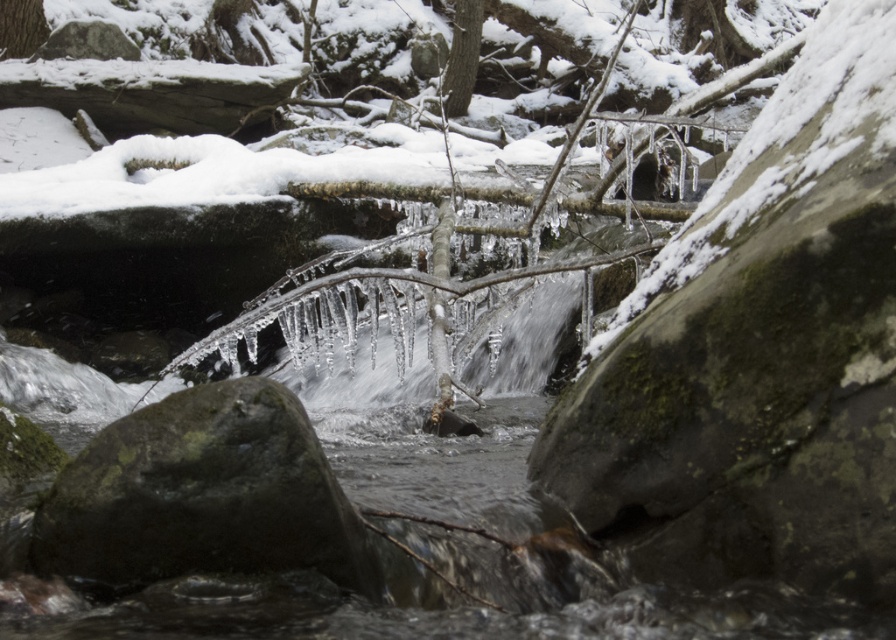
Question: Does green mossy rock at center appear over smooth bark tree at upper center?

Choices:
 (A) no
 (B) yes

Answer: (A)

Question: Which object appears farthest from the camera in this image?

Choices:
 (A) smooth bark tree at upper center
 (B) green mossy rock at center

Answer: (A)

Question: Which object appears farthest from the camera in this image?

Choices:
 (A) green mossy rock at center
 (B) smooth bark tree at upper center

Answer: (B)

Question: Is green mossy rock at center positioned behind smooth bark tree at upper center?

Choices:
 (A) no
 (B) yes

Answer: (A)

Question: Is green mossy rock at center positioned before smooth bark tree at upper center?

Choices:
 (A) yes
 (B) no

Answer: (A)